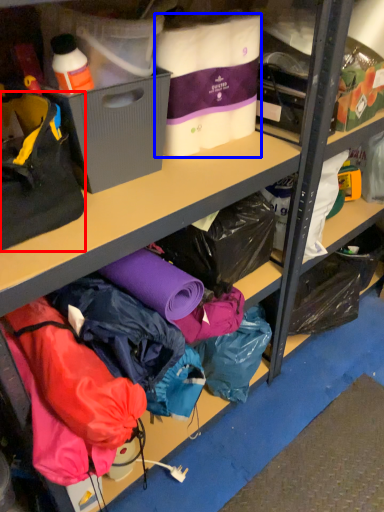
Question: Which point is closer to the camera, handbag (highlighted by a red box) or clothing (highlighted by a blue box)?

Choices:
 (A) handbag
 (B) clothing

Answer: (A)